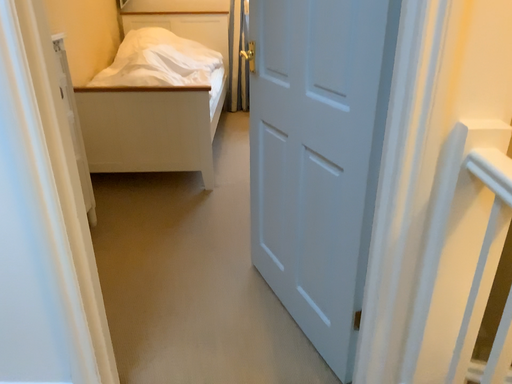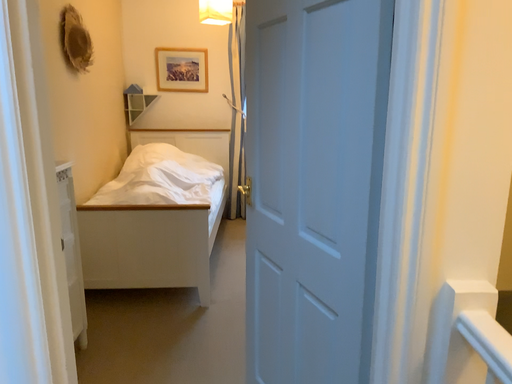
Question: Which way did the camera rotate in the video?

Choices:
 (A) rotated downward
 (B) rotated upward

Answer: (B)